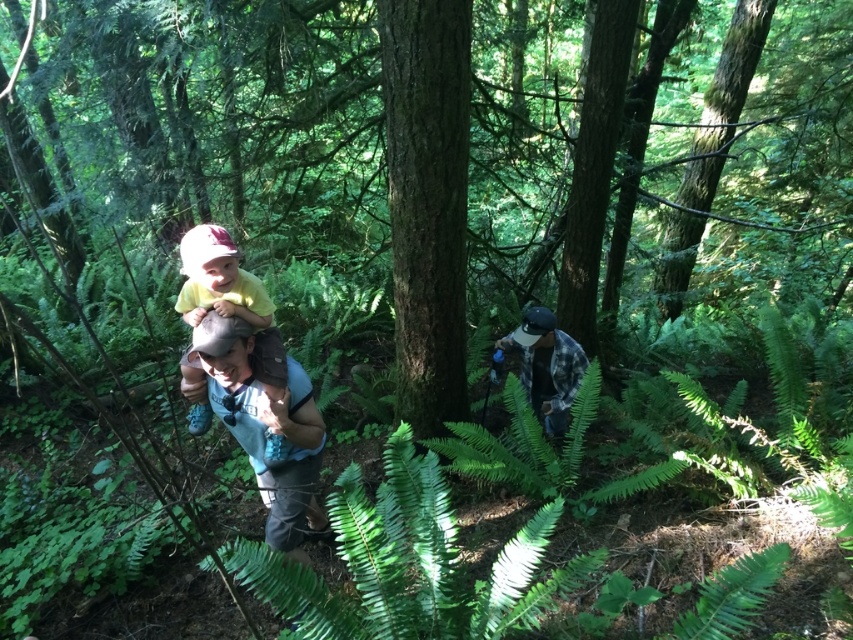
Question: Which point is farther to the camera?

Choices:
 (A) green leafy fern at lower center
 (B) flannel shirt at center
 (C) green rough bark tree at center

Answer: (B)

Question: Is green rough bark tree at center below denim jacket at center?

Choices:
 (A) no
 (B) yes

Answer: (A)

Question: Does green rough bark tree at center appear on the right side of denim jacket at center?

Choices:
 (A) no
 (B) yes

Answer: (B)

Question: Is green leafy fern at center below green leafy fern at lower center?

Choices:
 (A) no
 (B) yes

Answer: (A)

Question: Which object appears closest to the camera in this image?

Choices:
 (A) green leafy fern at lower center
 (B) denim jacket at center
 (C) flannel shirt at center

Answer: (A)

Question: Which of the following is the closest to the observer?

Choices:
 (A) green leafy fern at lower center
 (B) green rough bark tree at center

Answer: (A)